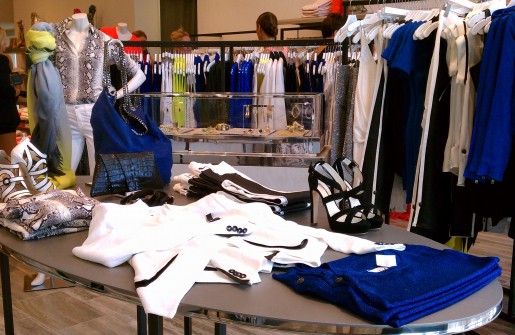
I want to click on table, so click(53, 242), click(281, 300).